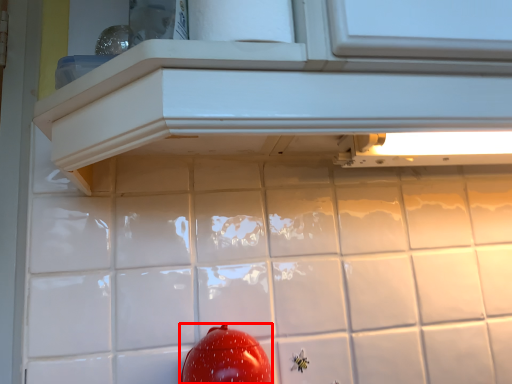
Question: Considering the relative positions of tomato (annotated by the red box) and cabinetry in the image provided, where is tomato (annotated by the red box) located with respect to the staircase?

Choices:
 (A) left
 (B) right

Answer: (B)